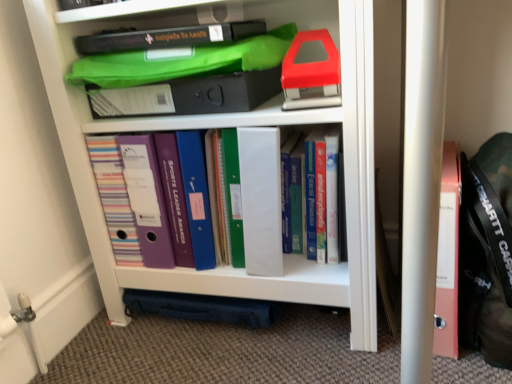
Question: From a real-world perspective, is white plastic shelf at center physically located above or below red plastic stapler at upper right, the 2th book viewed from the right?

Choices:
 (A) above
 (B) below

Answer: (B)

Question: In terms of width, does white plastic shelf at center look wider or thinner when compared to red plastic stapler at upper right, which appears as the 2th book when viewed from the left?

Choices:
 (A) thin
 (B) wide

Answer: (B)

Question: Considering the real-world distances, which object is closest to the white plastic shelf at center?

Choices:
 (A) matte plastic folders at center, the 1th book from the left
 (B) black fabric messenger bag at right
 (C) red plastic stapler at upper right, the 2th book viewed from the right
 (D) hardcover books at center, which is the 1th book in right-to-left order

Answer: (A)

Question: Which is farther from the matte plastic folders at center, the 1th book from the left?

Choices:
 (A) red plastic stapler at upper right, which appears as the 2th book when viewed from the left
 (B) black fabric messenger bag at right
 (C) hardcover books at center, which is the 1th book in right-to-left order
 (D) white plastic shelf at center

Answer: (B)